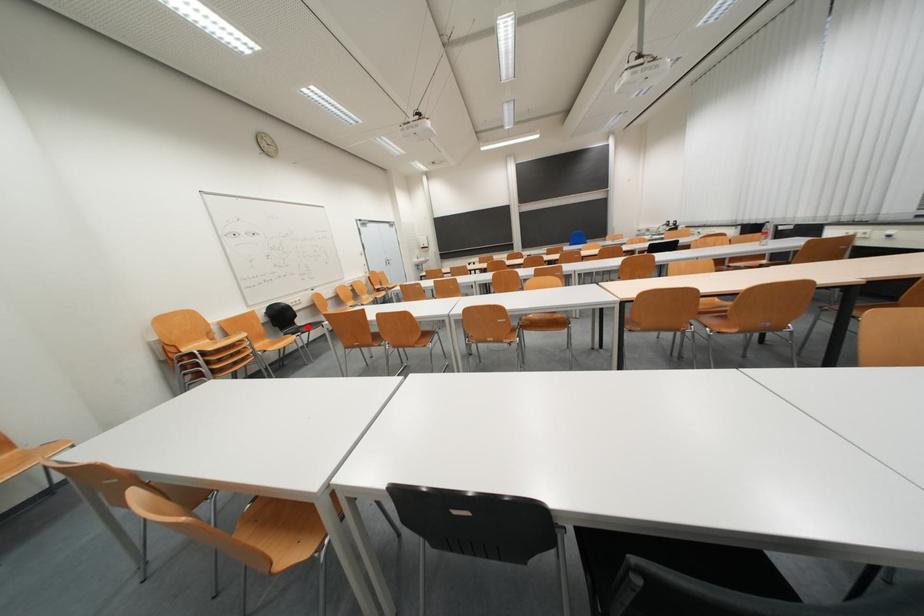
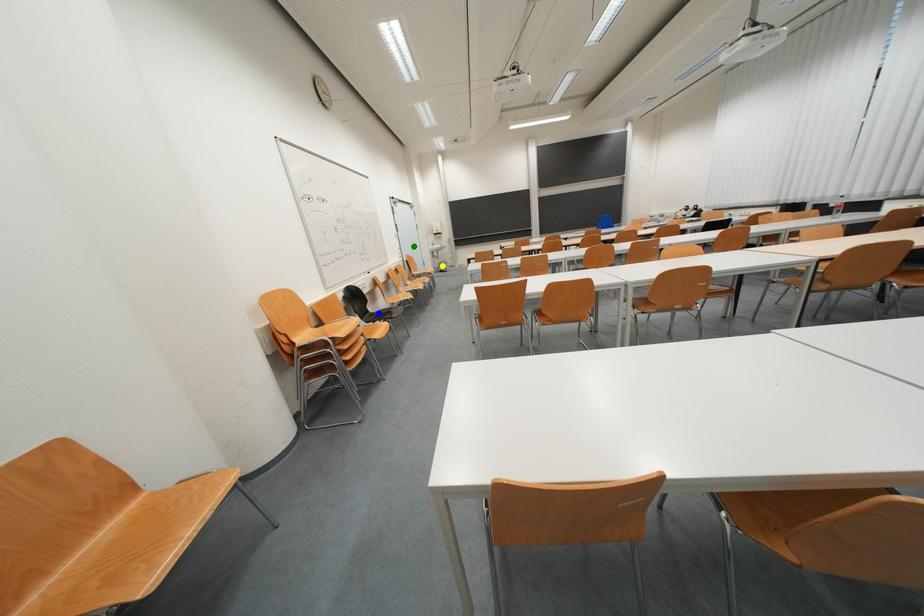
Question: I am providing you with two images of the same scene from different viewpoints. A red point is marked on the first image. You are given multiple points on the second image. Which point in image 2 represents the same 3d spot as the red point in image 1?

Choices:
 (A) yellow point
 (B) blue point
 (C) green point

Answer: (B)